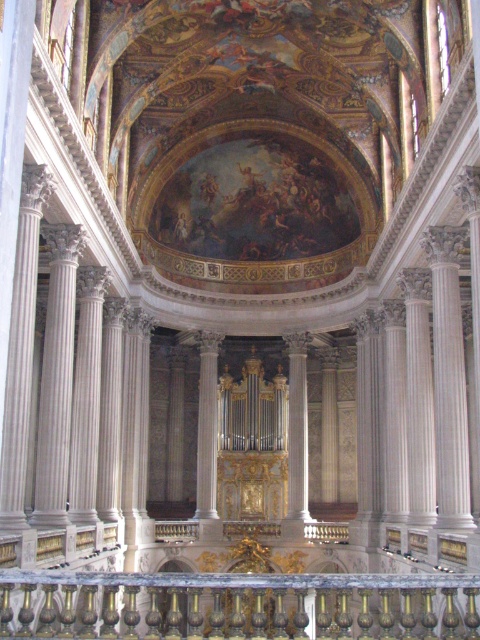
Does gold polished metal railing at center appear over white marble pillar at center?

Actually, gold polished metal railing at center is below white marble pillar at center.

Does gold polished metal railing at center lie in front of white marble pillar at center?

That is True.

Is point (170, 608) positioned in front of point (303, 433)?

Yes, point (170, 608) is in front of point (303, 433).

At what (x,y) coordinates should I click in order to perform the action: click on gold polished metal railing at center. Please return your answer as a coordinate pair (x, y). Looking at the image, I should click on (238, 605).